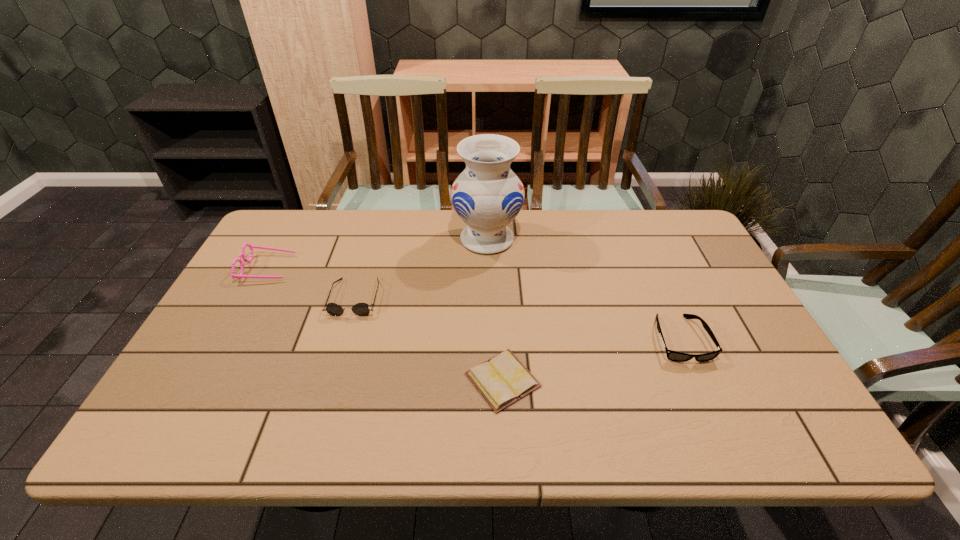
Where is `the tallest object`? the tallest object is located at coordinates (487, 196).

What are the coordinates of `spectacles` in the screenshot? It's located at (242, 254).

Where is `the leftmost object`? the leftmost object is located at coordinates (242, 254).

The width and height of the screenshot is (960, 540). I want to click on the left sunglasses, so 361,309.

What are the coordinates of `the right sunglasses` in the screenshot? It's located at (671, 355).

Locate an element on the screen. diary is located at coordinates (502, 380).

The width and height of the screenshot is (960, 540). Identify the location of free location located on the right of the tallest object. (564, 239).

Where is `vacant region located on the arms of the leftmost object`? The image size is (960, 540). vacant region located on the arms of the leftmost object is located at coordinates (311, 268).

This screenshot has width=960, height=540. I want to click on vacant space situated 0.350m on the front-facing side of the left sunglasses, so click(x=312, y=440).

The width and height of the screenshot is (960, 540). I want to click on vacant point located 0.100m on the front-facing side of the right sunglasses, so click(708, 402).